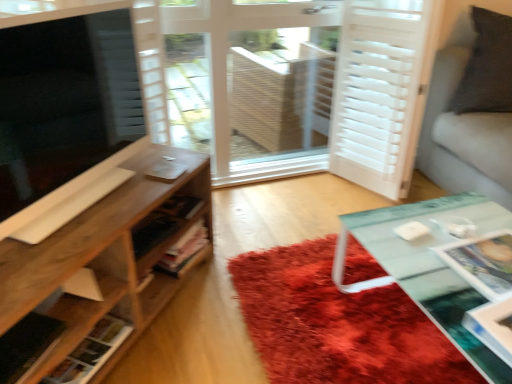
This screenshot has height=384, width=512. Describe the element at coordinates (463, 120) in the screenshot. I see `dark gray fabric couch at upper right` at that location.

Image resolution: width=512 pixels, height=384 pixels. What are the coordinates of `shaggy red rug at center` in the screenshot? It's located at (337, 324).

Where is `wooden shelf at left, positioned as the first shelf in top-to-bottom order`? wooden shelf at left, positioned as the first shelf in top-to-bottom order is located at coordinates (106, 256).

Identify the location of wooden shelf at lower left, marked as the first shelf in a bottom-to-top arrangement. (91, 352).

Considering the points (418, 79) and (429, 109), which point is in front, point (418, 79) or point (429, 109)?

The point (418, 79) is more forward.

Is white matte screen door at right, the 2th screen door in the left-to-right sequence, in front of dark gray fabric couch at upper right?

No, white matte screen door at right, the 2th screen door in the left-to-right sequence, is further to the viewer.

From the image's perspective, which is above, white matte screen door at right, positioned as the 1th screen door in right-to-left order, or dark gray fabric couch at upper right?

dark gray fabric couch at upper right, from the image's perspective.

Is white wooden screen door at center, arranged as the 1th screen door when viewed from the left, closer to the viewer compared to matte black tv at left?

No, white wooden screen door at center, arranged as the 1th screen door when viewed from the left, is behind matte black tv at left.

From the image's perspective, would you say white wooden screen door at center, arranged as the 1th screen door when viewed from the left, is shown under matte black tv at left?

No, from the image's perspective, white wooden screen door at center, arranged as the 1th screen door when viewed from the left, is not beneath matte black tv at left.

Which of these two, white wooden screen door at center, marked as the second screen door in a right-to-left arrangement, or matte black tv at left, stands taller?

Standing taller between the two is white wooden screen door at center, marked as the second screen door in a right-to-left arrangement.

From the picture: Is wooden shelf at lower left, marked as the first shelf in a bottom-to-top arrangement, shorter than wooden shelf at left, positioned as the first shelf in top-to-bottom order?

Indeed, wooden shelf at lower left, marked as the first shelf in a bottom-to-top arrangement, has a lesser height compared to wooden shelf at left, positioned as the first shelf in top-to-bottom order.

Between wooden shelf at lower left, which is the second shelf in top-to-bottom order, and wooden shelf at left, the second shelf when ordered from bottom to top, which one appears on the left side from the viewer's perspective?

wooden shelf at left, the second shelf when ordered from bottom to top.

Is wooden shelf at lower left, marked as the first shelf in a bottom-to-top arrangement, placed right next to wooden shelf at left, positioned as the first shelf in top-to-bottom order?

They are not placed beside each other.

From the image's perspective, is matte black tv at left located above white matte screen door at right, the 2th screen door in the left-to-right sequence?

No, from the image's perspective, matte black tv at left is not over white matte screen door at right, the 2th screen door in the left-to-right sequence.

Is matte black tv at left further to camera compared to white matte screen door at right, positioned as the 1th screen door in right-to-left order?

No, matte black tv at left is closer to the camera.

Considering the points (25, 166) and (414, 21), which point is behind, point (25, 166) or point (414, 21)?

Point (414, 21)

Is matte black tv at left facing away from shaggy red rug at center?

matte black tv at left does not have its back to shaggy red rug at center.

Can you confirm if matte black tv at left is taller than shaggy red rug at center?

Correct, matte black tv at left is much taller as shaggy red rug at center.

From the image's perspective, who appears lower, matte black tv at left or shaggy red rug at center?

shaggy red rug at center is shown below in the image.

From a real-world perspective, is matte black tv at left physically located above or below shaggy red rug at center?

matte black tv at left is situated higher than shaggy red rug at center in the real world.

Is wooden shelf at left, positioned as the first shelf in top-to-bottom order, far from matte black tv at left?

No, wooden shelf at left, positioned as the first shelf in top-to-bottom order, is not far from matte black tv at left.

Considering the sizes of objects wooden shelf at left, the second shelf when ordered from bottom to top, and matte black tv at left in the image provided, who is thinner, wooden shelf at left, the second shelf when ordered from bottom to top, or matte black tv at left?

matte black tv at left.

From a real-world perspective, is wooden shelf at left, positioned as the first shelf in top-to-bottom order, physically below matte black tv at left?

Correct, in the physical world, wooden shelf at left, positioned as the first shelf in top-to-bottom order, is lower than matte black tv at left.

Is white matte screen door at right, positioned as the 1th screen door in right-to-left order, to the left or to the right of shaggy red rug at center in the image?

Clearly, white matte screen door at right, positioned as the 1th screen door in right-to-left order, is on the right of shaggy red rug at center in the image.

From the image's perspective, which is above, white matte screen door at right, positioned as the 1th screen door in right-to-left order, or shaggy red rug at center?

white matte screen door at right, positioned as the 1th screen door in right-to-left order, appears higher in the image.

Is white matte screen door at right, positioned as the 1th screen door in right-to-left order, oriented away from shaggy red rug at center?

No, white matte screen door at right, positioned as the 1th screen door in right-to-left order, is not facing away from shaggy red rug at center.

Is point (338, 135) closer or farther from the camera than point (239, 295)?

Point (338, 135) appears to be farther away from the viewer than point (239, 295).

What are the coordinates of `couch above the white matte screen door at right, the 2th screen door in the left-to-right sequence (from the image's perspective)` in the screenshot? It's located at (463, 120).

At what (x,y) coordinates should I click in order to perform the action: click on window screen below the white wooden screen door at center, arranged as the 1th screen door when viewed from the left (from the image's perspective). Please return your answer as a coordinate pair (x, y). This screenshot has height=384, width=512. Looking at the image, I should click on (65, 110).

Based on their spatial positions, is matte black tv at left or dark gray fabric couch at upper right closer to wooden shelf at left, positioned as the first shelf in top-to-bottom order?

matte black tv at left lies closer to wooden shelf at left, positioned as the first shelf in top-to-bottom order, than the other object.

When comparing their distances from dark gray fabric couch at upper right, does shaggy red rug at center or wooden shelf at left, positioned as the first shelf in top-to-bottom order, seem closer?

Among the two, shaggy red rug at center is located nearer to dark gray fabric couch at upper right.

When comparing their distances from matte black tv at left, does wooden shelf at lower left, which is the second shelf in top-to-bottom order, or dark gray fabric couch at upper right seem further?

dark gray fabric couch at upper right.

Estimate the real-world distances between objects in this image. Which object is closer to dark gray fabric couch at upper right, white wooden screen door at center, arranged as the 1th screen door when viewed from the left, or white matte screen door at right, the 2th screen door in the left-to-right sequence?

white matte screen door at right, the 2th screen door in the left-to-right sequence, lies closer to dark gray fabric couch at upper right than the other object.

When comparing their distances from dark gray fabric couch at upper right, does white matte screen door at right, positioned as the 1th screen door in right-to-left order, or wooden shelf at lower left, marked as the first shelf in a bottom-to-top arrangement, seem further?

Among the two, wooden shelf at lower left, marked as the first shelf in a bottom-to-top arrangement, is located further to dark gray fabric couch at upper right.

Which object lies nearer to the anchor point matte black tv at left, white wooden screen door at center, arranged as the 1th screen door when viewed from the left, or wooden shelf at left, the second shelf when ordered from bottom to top?

wooden shelf at left, the second shelf when ordered from bottom to top.

When comparing their distances from wooden shelf at lower left, marked as the first shelf in a bottom-to-top arrangement, does wooden shelf at left, the second shelf when ordered from bottom to top, or shaggy red rug at center seem further?

shaggy red rug at center is positioned further to the anchor wooden shelf at lower left, marked as the first shelf in a bottom-to-top arrangement.

When comparing their distances from shaggy red rug at center, does white wooden screen door at center, marked as the second screen door in a right-to-left arrangement, or matte black tv at left seem closer?

The object closer to shaggy red rug at center is matte black tv at left.

You are a GUI agent. You are given a task and a screenshot of the screen. Output one action in this format:
    pyautogui.click(x=<x>, y=<y>)
    Task: Click on the shelf located between wooden shelf at left, the second shelf when ordered from bottom to top, and dark gray fabric couch at upper right in the left-right direction
    This screenshot has width=512, height=384.
    Given the screenshot: What is the action you would take?
    pyautogui.click(x=91, y=352)

Locate an element on the screen. The width and height of the screenshot is (512, 384). screen door between wooden shelf at left, positioned as the first shelf in top-to-bottom order, and white matte screen door at right, positioned as the 1th screen door in right-to-left order, from left to right is located at coordinates (300, 86).

Where is `mat situated between wooden shelf at lower left, marked as the first shelf in a bottom-to-top arrangement, and white matte screen door at right, the 2th screen door in the left-to-right sequence, from left to right`? mat situated between wooden shelf at lower left, marked as the first shelf in a bottom-to-top arrangement, and white matte screen door at right, the 2th screen door in the left-to-right sequence, from left to right is located at coordinates (337, 324).

Find the location of a particular element. screen door between white wooden screen door at center, marked as the second screen door in a right-to-left arrangement, and shaggy red rug at center from top to bottom is located at coordinates (377, 91).